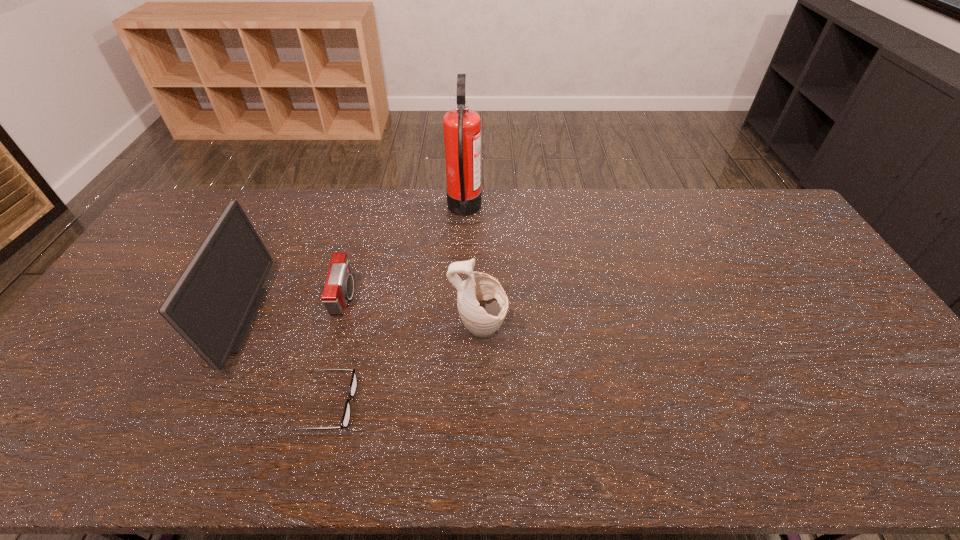
Find the location of a particular element. the tallest object is located at coordinates (462, 127).

Find the location of a particular element. The width and height of the screenshot is (960, 540). fire extinguisher is located at coordinates (462, 127).

At what (x,y) coordinates should I click in order to perform the action: click on pitcher. Please return your answer as a coordinate pair (x, y). Looking at the image, I should click on (482, 303).

Locate an element on the screen. the leftmost object is located at coordinates pos(213,304).

The image size is (960, 540). Find the location of `camera`. camera is located at coordinates (339, 286).

This screenshot has width=960, height=540. What are the coordinates of `spectacles` in the screenshot? It's located at (345, 420).

Where is `vacant space situated on the front-facing side of the fire extinguisher`? vacant space situated on the front-facing side of the fire extinguisher is located at coordinates (506, 211).

Find the location of `vacant position located 0.270m at the spout of the pitcher`. vacant position located 0.270m at the spout of the pitcher is located at coordinates (605, 331).

What are the coordinates of `vacant position located on the screen side of the leftmost object` in the screenshot? It's located at (384, 319).

Find the location of a particular element. vacant area located on the front-facing side of the second shortest object is located at coordinates (422, 298).